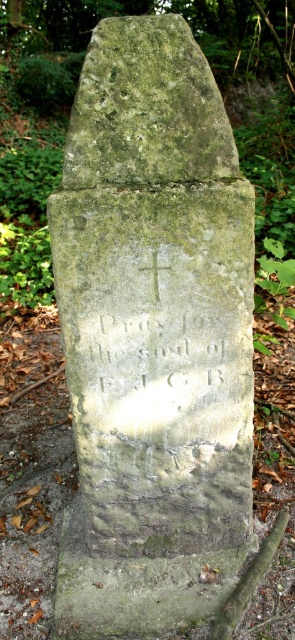
Is carved stone inscription at center positioned behind white stone cross at center?

Yes, it is.

In the scene shown: Does carved stone inscription at center have a greater height compared to white stone cross at center?

Indeed, carved stone inscription at center has a greater height compared to white stone cross at center.

Image resolution: width=295 pixels, height=640 pixels. Describe the element at coordinates (153, 348) in the screenshot. I see `carved stone inscription at center` at that location.

Identify the location of carved stone inscription at center. (153, 348).

Is green stone gravestone at center further to camera compared to carved stone inscription at center?

No, it is not.

Describe the element at coordinates (153, 333) in the screenshot. This screenshot has width=295, height=640. I see `green stone gravestone at center` at that location.

Locate an element on the screen. green stone gravestone at center is located at coordinates (153, 333).

Is green stone gravestone at center below white stone cross at center?

Correct, green stone gravestone at center is located below white stone cross at center.

Is green stone gravestone at center in front of white stone cross at center?

Yes, green stone gravestone at center is closer to the viewer.

The height and width of the screenshot is (640, 295). In order to click on green stone gravestone at center in this screenshot , I will do `click(153, 333)`.